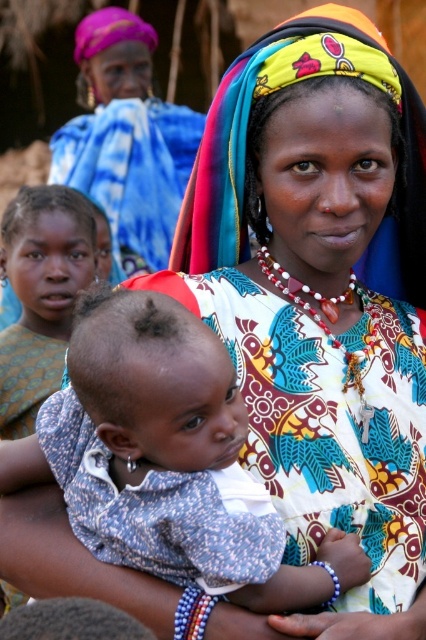
Which is above, blue dotted fabric baby at center or matte colorful headscarf at upper center?

matte colorful headscarf at upper center is above.

Which is more to the left, blue dotted fabric baby at center or matte colorful headscarf at upper center?

matte colorful headscarf at upper center

Is point (209, 406) farther from camera compared to point (101, 164)?

No, (209, 406) is in front of (101, 164).

This screenshot has height=640, width=426. In order to click on blue dotted fabric baby at center in this screenshot , I will do `click(170, 458)`.

Is point (126, 301) positioned after point (17, 349)?

No, (126, 301) is closer to viewer.

Which of these two, blue dotted fabric baby at center or matte brown skin at center, stands taller?

With more height is matte brown skin at center.

Between point (155, 308) and point (80, 250), which one is positioned behind?

The point (80, 250) is more distant.

In order to click on blue dotted fabric baby at center in this screenshot , I will do `click(170, 458)`.

Is matte colorful headscarf at upper center thinner than matte brown skin at center?

No.

Can you confirm if matte colorful headscarf at upper center is wider than matte brown skin at center?

Indeed, matte colorful headscarf at upper center has a greater width compared to matte brown skin at center.

Measure the distance between matte colorful headscarf at upper center and camera.

matte colorful headscarf at upper center and camera are 50.64 meters apart.

Image resolution: width=426 pixels, height=640 pixels. I want to click on matte colorful headscarf at upper center, so click(126, 138).